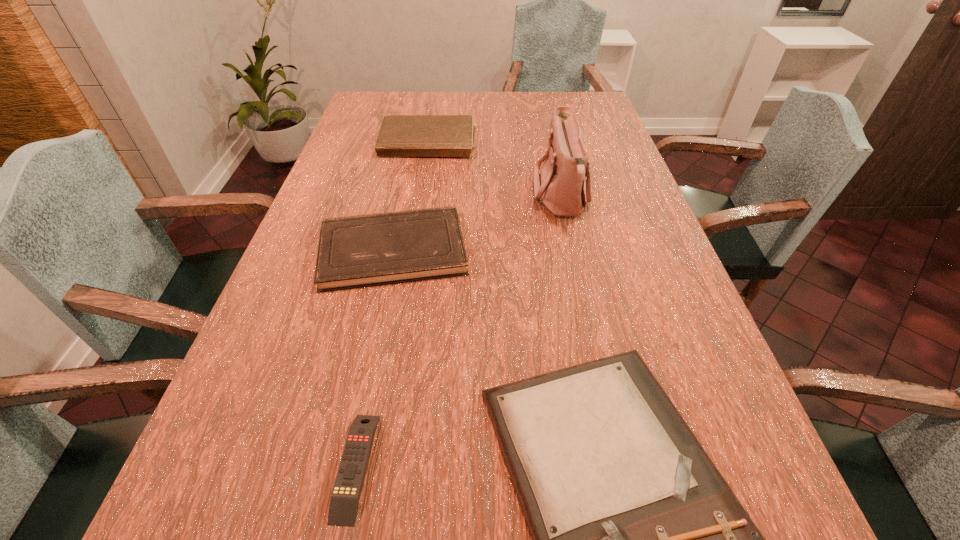
The width and height of the screenshot is (960, 540). What are the coordinates of `the tallest object` in the screenshot? It's located at (560, 187).

Image resolution: width=960 pixels, height=540 pixels. I want to click on the taller paperback book, so click(400, 135).

At what (x,y) coordinates should I click in order to perform the action: click on the farther paperback book. Please return your answer as a coordinate pair (x, y). The image size is (960, 540). Looking at the image, I should click on (400, 135).

The image size is (960, 540). I want to click on the nearer paperback book, so click(x=368, y=250).

This screenshot has height=540, width=960. Identify the location of the shorter paperback book. pos(368,250).

Locate an element on the screen. remote control is located at coordinates pos(344,502).

Find the location of a particular element. The height and width of the screenshot is (540, 960). free spot located on the front pocket of the tallest object is located at coordinates (416, 197).

You are a GUI agent. You are given a task and a screenshot of the screen. Output one action in this format:
    pyautogui.click(x=<x>, y=<y>)
    Task: Click on the vacant space located 0.300m on the front pocket of the tallest object
    
    Given the screenshot: What is the action you would take?
    pyautogui.click(x=422, y=197)

This screenshot has width=960, height=540. What are the coordinates of `free region located on the front pocket of the tallest object` in the screenshot? It's located at (478, 197).

The height and width of the screenshot is (540, 960). In order to click on free location located on the spine side of the fourth shortest object in this screenshot , I will do `click(416, 227)`.